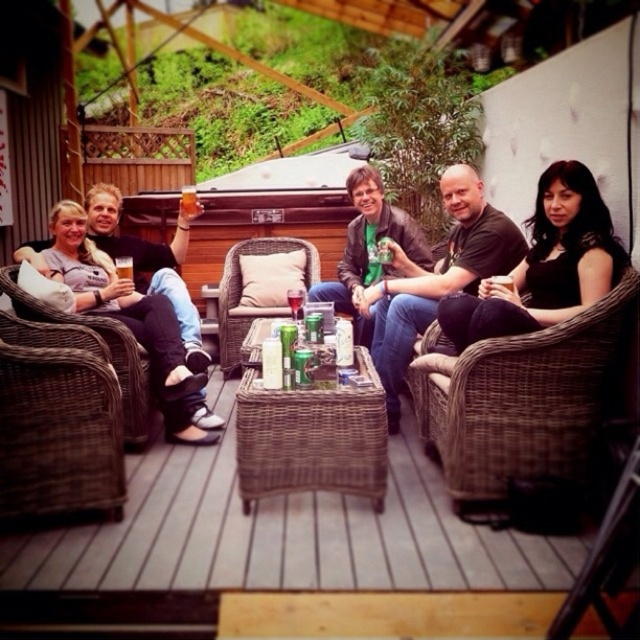
Question: Which point is closer to the camera?

Choices:
 (A) matte gray shirt at left
 (B) black leather jacket at center
 (C) brown wicker chair at right

Answer: (C)

Question: Among these objects, which one is farthest from the camera?

Choices:
 (A) translucent glass beer at center
 (B) black matte shirt at center
 (C) green matte can at center

Answer: (A)

Question: Which point appears farthest from the camera in this image?

Choices:
 (A) (381, 273)
 (B) (440, 301)
 (C) (467, 221)
 (D) (129, 275)

Answer: (A)

Question: Is black matte shirt at center below translucent glass beer at center?

Choices:
 (A) no
 (B) yes

Answer: (B)

Question: Is matte gray shirt at left to the right of brown wicker chair at left from the viewer's perspective?

Choices:
 (A) yes
 (B) no

Answer: (A)

Question: From the image, what is the correct spatial relationship of brown wicker chair at right in relation to brown wicker chair at left?

Choices:
 (A) above
 (B) below

Answer: (B)